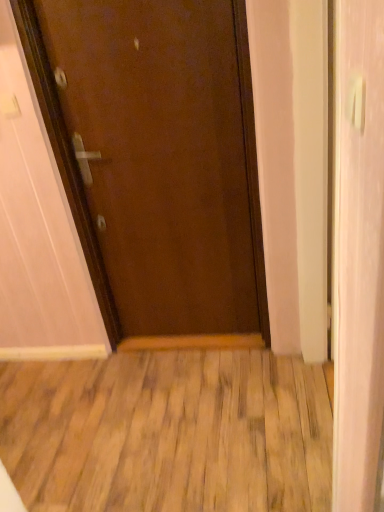
What are the coordinates of `blank space to the left of white glossy door at right` in the screenshot? It's located at (234, 426).